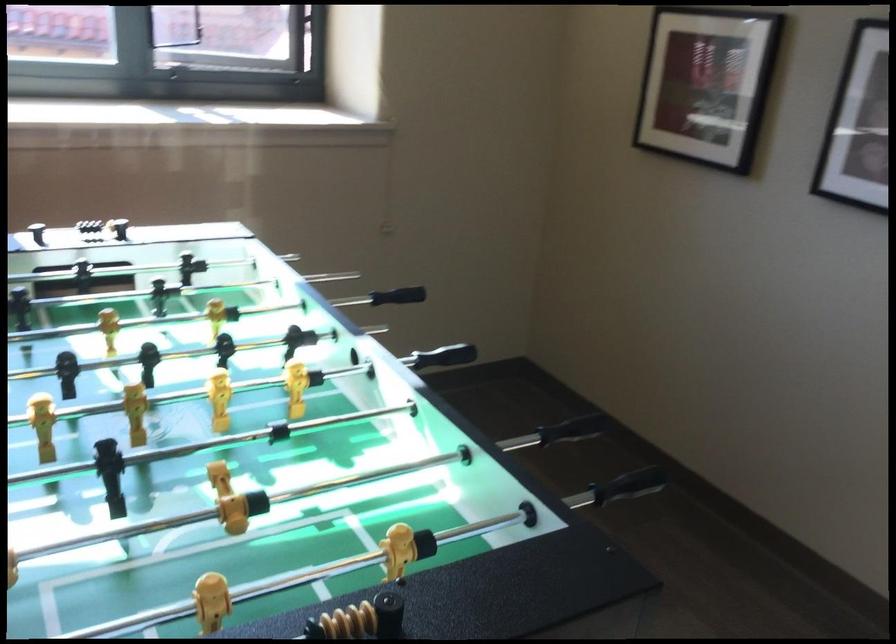
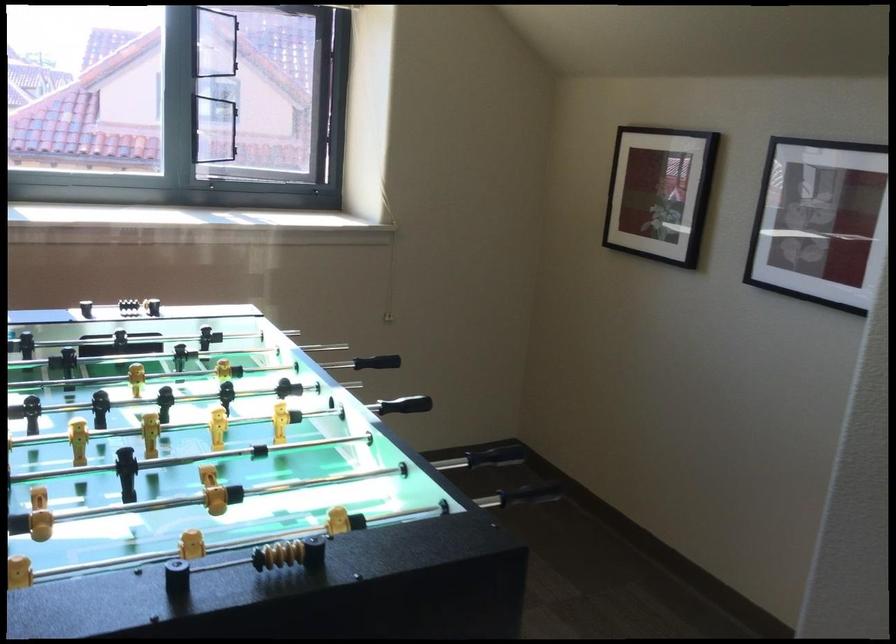
Where in the second image is the point corresponding to the point at 409,327 from the first image?

(406, 404)